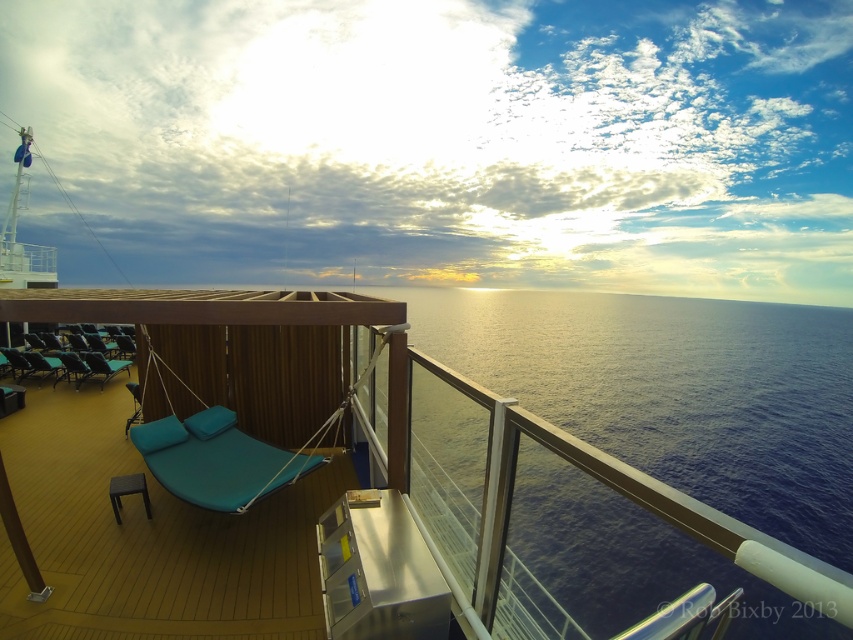
Question: Is blue water at center to the left of teal fabric lounge chair at center from the viewer's perspective?

Choices:
 (A) no
 (B) yes

Answer: (A)

Question: Which object is positioned farthest from the blue water at center?

Choices:
 (A) teal fabric daybed at center
 (B) teal fabric lounge chair at center

Answer: (B)

Question: Among these objects, which one is farthest from the camera?

Choices:
 (A) teal fabric lounge chair at center
 (B) teal fabric daybed at center

Answer: (A)

Question: Does blue water at center appear over teal fabric lounge chair at center?

Choices:
 (A) no
 (B) yes

Answer: (B)

Question: Can you confirm if blue water at center is positioned above teal fabric lounge chair at center?

Choices:
 (A) yes
 (B) no

Answer: (A)

Question: Which of the following is the farthest from the observer?

Choices:
 (A) (138, 444)
 (B) (689, 490)

Answer: (B)